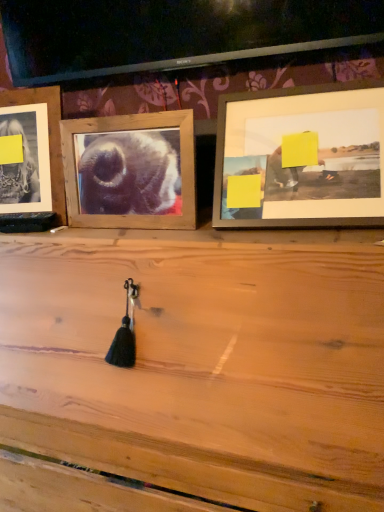
Question: Considering the positions of point (56, 109) and point (331, 172), is point (56, 109) closer or farther from the camera than point (331, 172)?

Choices:
 (A) farther
 (B) closer

Answer: (A)

Question: Visually, is wooden frame at left, the third picture frame in the right-to-left sequence, positioned to the left or to the right of wooden picture frame at upper right, the third picture frame when ordered from left to right?

Choices:
 (A) right
 (B) left

Answer: (B)

Question: Estimate the real-world distances between objects in this image. Which object is farther from the wooden frame at center, the second picture frame from the left?

Choices:
 (A) wooden frame at left, the third picture frame in the right-to-left sequence
 (B) wooden picture frame at upper right, the third picture frame when ordered from left to right

Answer: (B)

Question: Which of these objects is positioned closest to the wooden frame at center, the second picture frame from the left?

Choices:
 (A) wooden frame at left, the 1th picture frame in the left-to-right sequence
 (B) wooden picture frame at upper right, the third picture frame when ordered from left to right

Answer: (A)